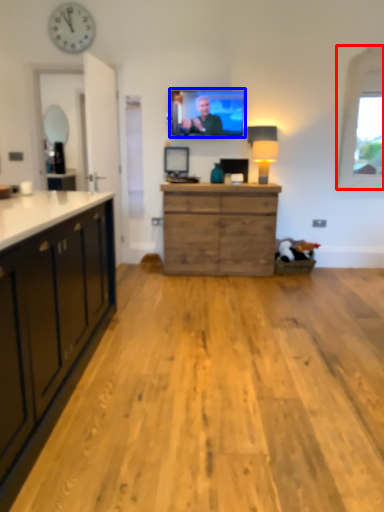
Question: Among these objects, which one is nearest to the camera, window (highlighted by a red box) or television (highlighted by a blue box)?

Choices:
 (A) window
 (B) television

Answer: (A)